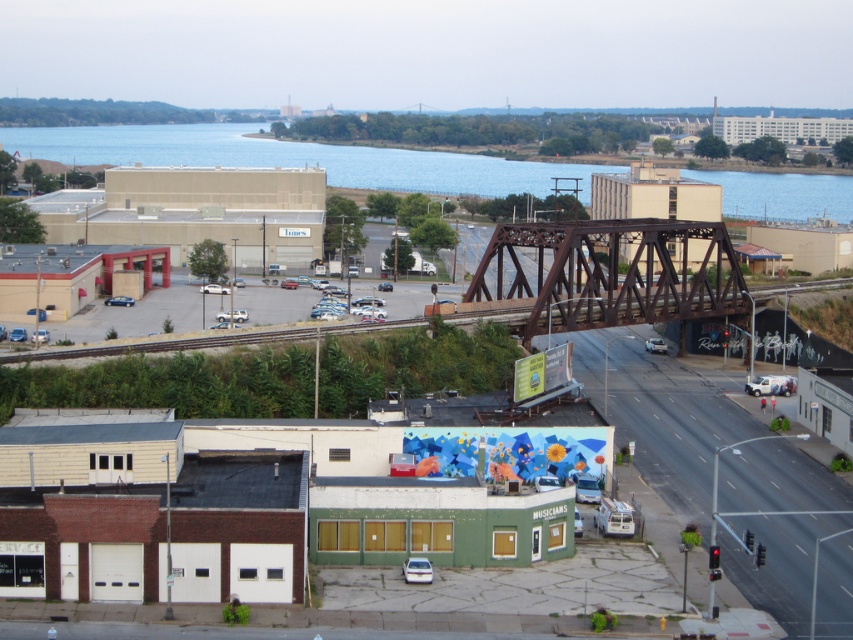
You are a delivery driver who needs to park your white matte sedan at center in a parking spot that is exactly the width of the metallic silver sedan at center. Can your sedan fit into the parking spot without overlapping the lines?

The white matte sedan at center is wider than the metallic silver sedan at center, so it cannot fit into the parking spot designed for the metallic silver sedan at center without overlapping the lines.

You are standing at the point labeled as point (297,157) in the image. What do you see in front of you?

You see blue water at upper center in front of you.

You are a delivery driver who needs to cross the brown metal bridge at center with your metallic silver sedan at center. Can you safely drive your car onto the bridge without any issues?

The brown metal bridge at center and metallic silver sedan at center are 55.67 meters apart. Since the distance between them is significant, you can safely drive your metallic silver sedan at center onto the brown metal bridge at center as there is enough space between them to maneuver.